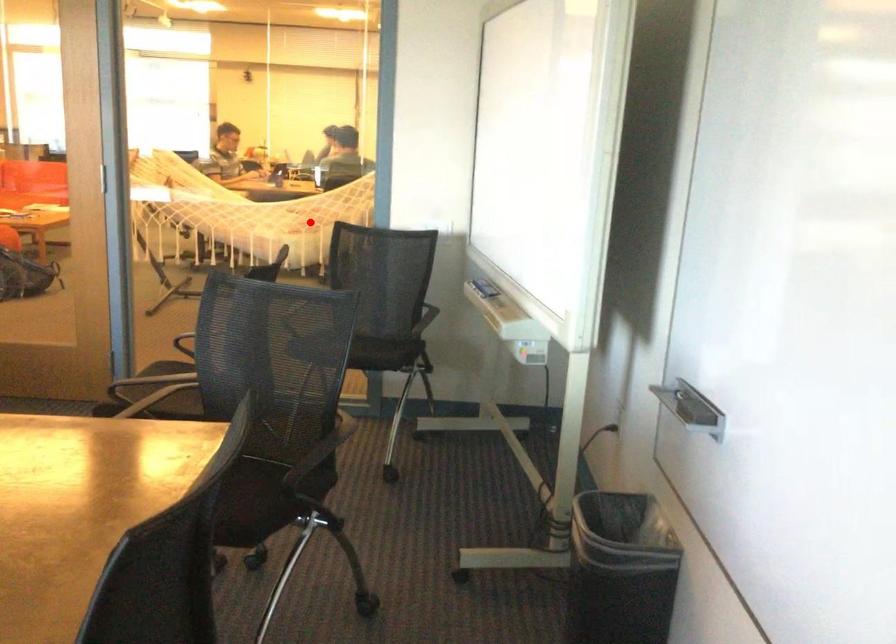
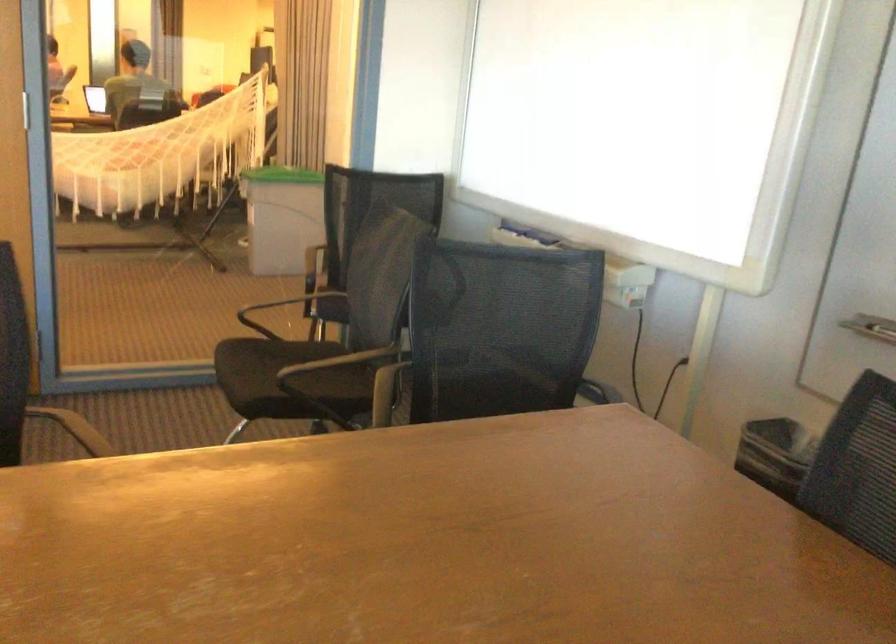
Question: I am providing you with two images of the same scene from different viewpoints. Image1 has a red point marked. In image2, the corresponding 3D location appears at what relative position? Reply with the corresponding letter.

Choices:
 (A) Closer
 (B) Farther

Answer: (A)